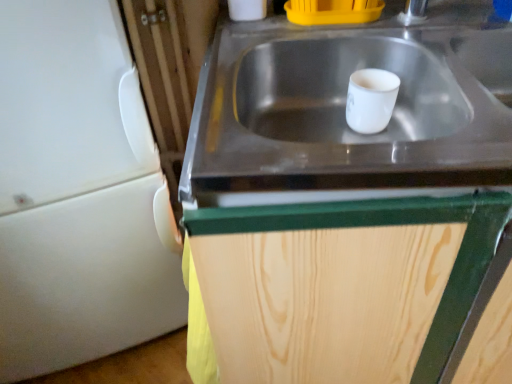
Question: From a real-world perspective, is white matte refrigerator at left physically below stainless steel sink at center?

Choices:
 (A) no
 (B) yes

Answer: (B)

Question: Is white matte refrigerator at left oriented away from stainless steel sink at center?

Choices:
 (A) no
 (B) yes

Answer: (A)

Question: Is white matte refrigerator at left outside of stainless steel sink at center?

Choices:
 (A) no
 (B) yes

Answer: (B)

Question: Are white matte refrigerator at left and stainless steel sink at center far apart?

Choices:
 (A) yes
 (B) no

Answer: (B)

Question: From the image's perspective, is white matte refrigerator at left above stainless steel sink at center?

Choices:
 (A) no
 (B) yes

Answer: (A)

Question: In the image, is wooden cabinet at center positioned in front of or behind stainless steel sink at center?

Choices:
 (A) behind
 (B) front

Answer: (A)

Question: Considering the positions of point (247, 215) and point (477, 165), is point (247, 215) closer or farther from the camera than point (477, 165)?

Choices:
 (A) farther
 (B) closer

Answer: (B)

Question: Looking at their shapes, would you say wooden cabinet at center is wider or thinner than stainless steel sink at center?

Choices:
 (A) thin
 (B) wide

Answer: (B)

Question: Is wooden cabinet at center taller or shorter than stainless steel sink at center?

Choices:
 (A) short
 (B) tall

Answer: (B)

Question: Considering their positions, is wooden cabinet at center located in front of or behind white matte refrigerator at left?

Choices:
 (A) front
 (B) behind

Answer: (A)

Question: Is point (323, 208) positioned closer to the camera than point (136, 226)?

Choices:
 (A) closer
 (B) farther

Answer: (A)

Question: From a real-world perspective, is wooden cabinet at center physically located above or below white matte refrigerator at left?

Choices:
 (A) below
 (B) above

Answer: (A)

Question: Looking at the image, does wooden cabinet at center seem bigger or smaller compared to white matte refrigerator at left?

Choices:
 (A) small
 (B) big

Answer: (B)

Question: Considering the positions of white matte refrigerator at left and wooden cabinet at center in the image, is white matte refrigerator at left taller or shorter than wooden cabinet at center?

Choices:
 (A) short
 (B) tall

Answer: (B)

Question: From a real-world perspective, is white matte refrigerator at left above or below wooden cabinet at center?

Choices:
 (A) below
 (B) above

Answer: (B)